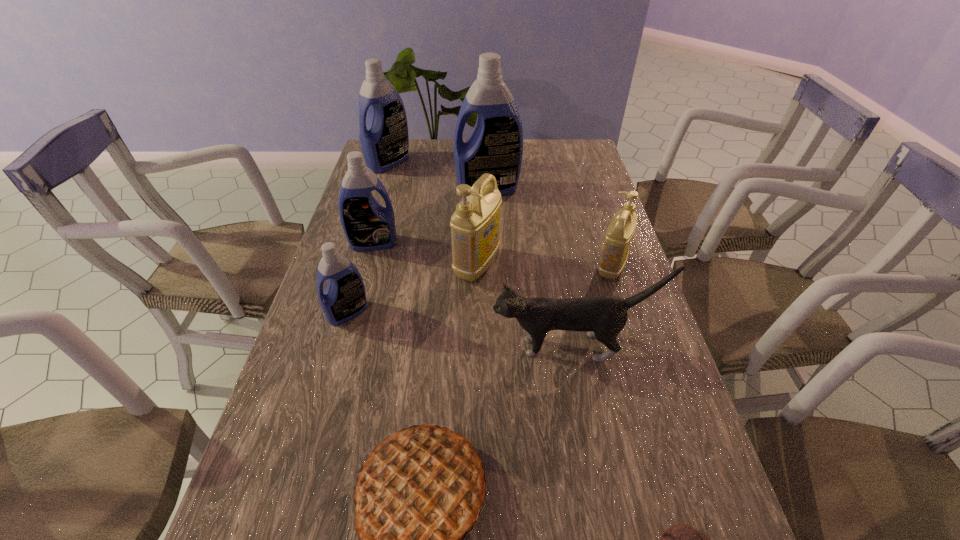
Locate an element on the screen. This screenshot has height=540, width=960. object that is positioned at the far edge is located at coordinates (384, 140).

The width and height of the screenshot is (960, 540). In order to click on cat at the right edge in this screenshot , I will do `click(604, 317)`.

Where is `detergent that is positioned at the right edge`? Image resolution: width=960 pixels, height=540 pixels. detergent that is positioned at the right edge is located at coordinates (618, 237).

Where is `object located in the far left corner section of the desktop`? The height and width of the screenshot is (540, 960). object located in the far left corner section of the desktop is located at coordinates (384, 140).

Identify the location of vacant space at the far edge of the desktop. (419, 139).

Where is `vacant space at the left edge of the desktop`? The height and width of the screenshot is (540, 960). vacant space at the left edge of the desktop is located at coordinates (295, 411).

At what (x,y) coordinates should I click in order to perform the action: click on blank space at the right edge of the desktop. Please return your answer as a coordinate pair (x, y). This screenshot has width=960, height=540. Looking at the image, I should click on (574, 179).

At what (x,y) coordinates should I click in order to perform the action: click on vacant space at the far right corner. Please return your answer as a coordinate pair (x, y). Image resolution: width=960 pixels, height=540 pixels. Looking at the image, I should click on (552, 167).

The height and width of the screenshot is (540, 960). I want to click on free spot between the third nearest object and the smallest blue detergent, so click(460, 329).

Identify the location of free space that is in between the third farthest blue detergent and the left beige detergent. The height and width of the screenshot is (540, 960). (425, 254).